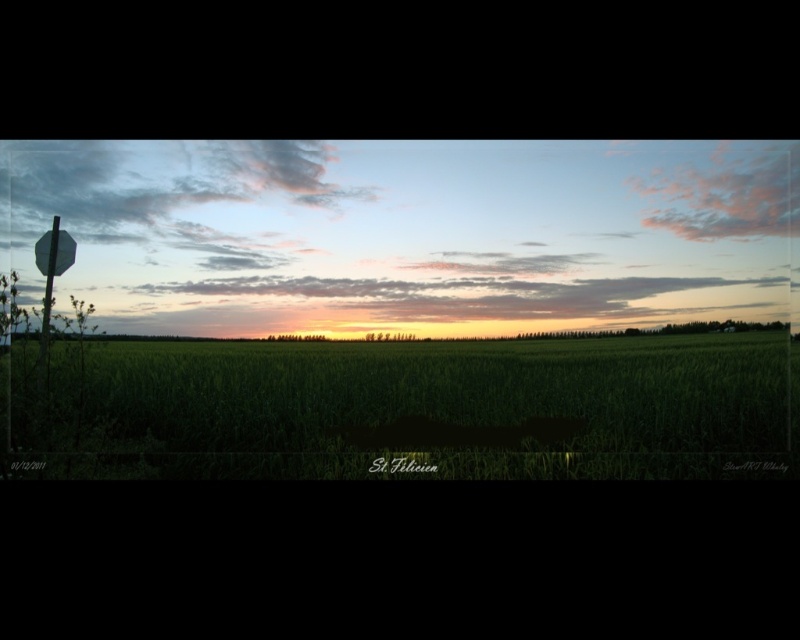
Is green grass at center thinner than metallic stop sign at left?

No, green grass at center is not thinner than metallic stop sign at left.

Is point (230, 422) behind point (60, 268)?

No, (230, 422) is closer to viewer.

Where is `green grass at center`? The width and height of the screenshot is (800, 640). green grass at center is located at coordinates (405, 408).